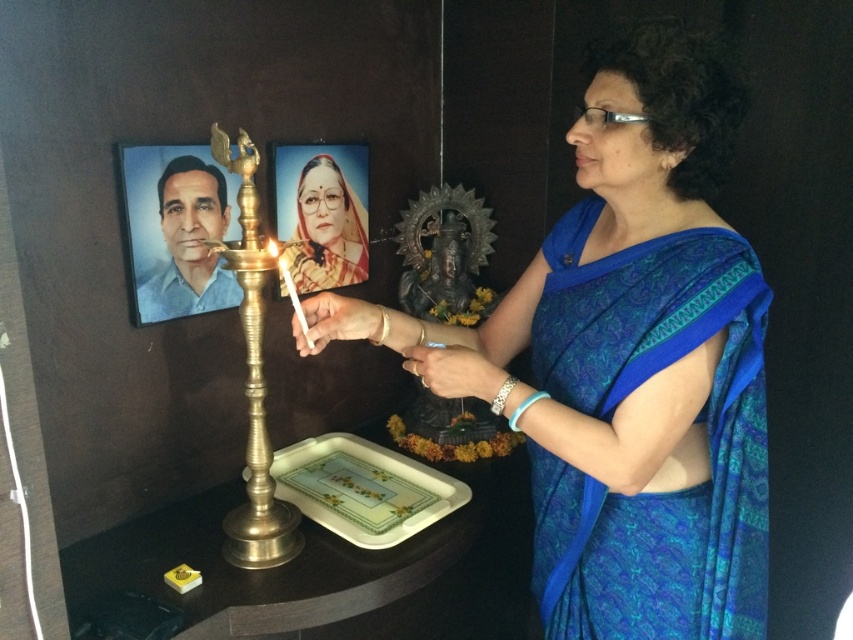
Is green glossy tray at center shorter than matte yellow portrait at upper center?

Yes.

Describe the element at coordinates (363, 488) in the screenshot. This screenshot has height=640, width=853. I see `green glossy tray at center` at that location.

Find the location of a particular element. This screenshot has height=640, width=853. green glossy tray at center is located at coordinates (363, 488).

Is point (544, 472) positioned after point (340, 212)?

No, (544, 472) is closer to viewer.

Which is below, blue silk saree at center or matte yellow portrait at upper center?

blue silk saree at center is below.

Is point (546, 390) more distant than point (360, 205)?

No, it is in front of (360, 205).

The image size is (853, 640). Find the location of `blue silk saree at center`. blue silk saree at center is located at coordinates (627, 358).

Between point (537, 253) and point (254, 541), which one is positioned in front?

Point (537, 253) is in front.

How distant is blue silk saree at center from gold brass candle holder at center?

A distance of 49.53 centimeters exists between blue silk saree at center and gold brass candle holder at center.

Measure the distance between point (647,401) and camera.

3.36 feet

Where is `blue silk saree at center`? This screenshot has height=640, width=853. blue silk saree at center is located at coordinates (627, 358).